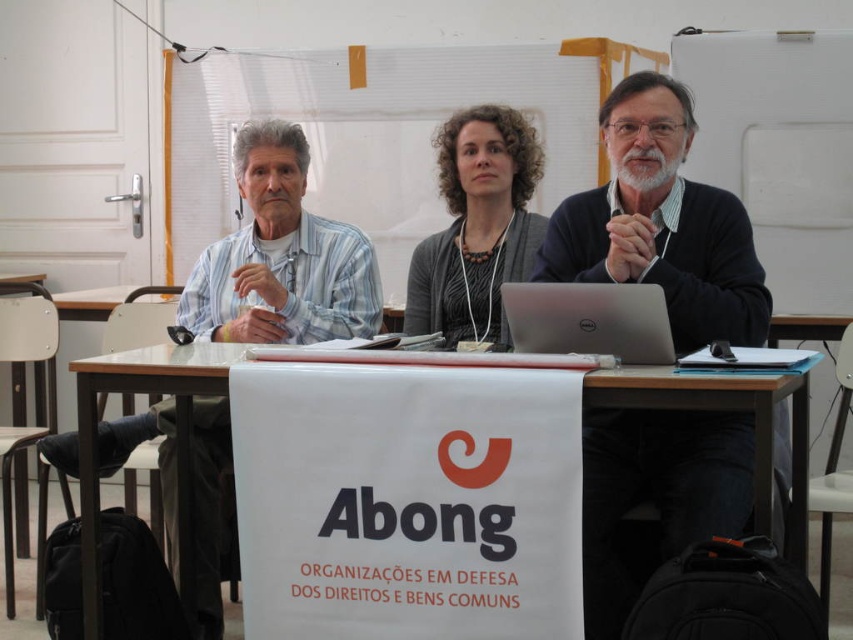
How distant is dark blue sweater at center from white wood table at center?

A distance of 1.08 meters exists between dark blue sweater at center and white wood table at center.

Between dark blue sweater at center and white wood table at center, which one is positioned higher?

dark blue sweater at center is higher up.

Between point (675, 452) and point (215, 392), which one is positioned behind?

The point (675, 452) is behind.

Where is `dark blue sweater at center`? dark blue sweater at center is located at coordinates (660, 224).

The image size is (853, 640). What do you see at coordinates (660, 224) in the screenshot?
I see `dark blue sweater at center` at bounding box center [660, 224].

Which is below, dark blue sweater at center or light blue striped shirt at left?

Positioned lower is light blue striped shirt at left.

Who is more distant from viewer, (631,184) or (271,273)?

Positioned behind is point (271,273).

The width and height of the screenshot is (853, 640). What are the coordinates of `dark blue sweater at center` in the screenshot? It's located at (660, 224).

Does white wood table at center lie in front of dark gray sweater at center?

Yes, white wood table at center is closer to the viewer.

Where is `white wood table at center`? This screenshot has height=640, width=853. white wood table at center is located at coordinates (173, 440).